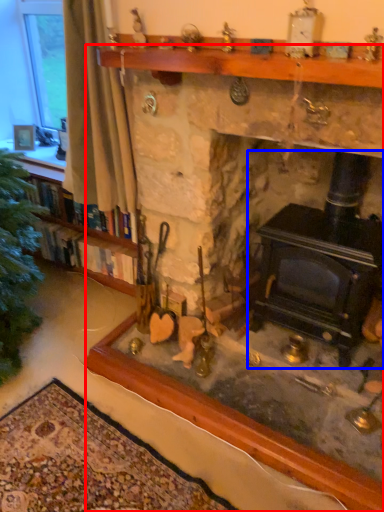
Question: Which object appears closest to the camera in this image, fireplace (highlighted by a red box) or wood burning stove (highlighted by a blue box)?

Choices:
 (A) fireplace
 (B) wood burning stove

Answer: (A)